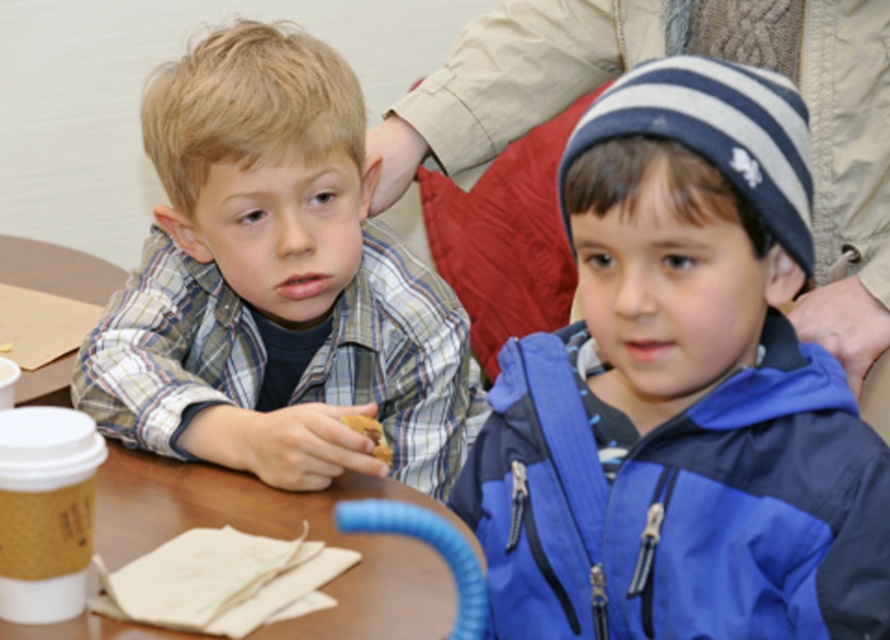
Can you confirm if blue fleece jacket at center is wider than brown crumbly cookie at center?

Yes, blue fleece jacket at center is wider than brown crumbly cookie at center.

The width and height of the screenshot is (890, 640). What do you see at coordinates (681, 392) in the screenshot?
I see `blue fleece jacket at center` at bounding box center [681, 392].

Between point (579, 566) and point (390, 461), which one is positioned in front?

Point (579, 566)

The image size is (890, 640). Find the location of `blue fleece jacket at center`. blue fleece jacket at center is located at coordinates (681, 392).

Can you confirm if plaid shirt at left is bigger than brown crumbly cookie at center?

Correct, plaid shirt at left is larger in size than brown crumbly cookie at center.

Measure the distance between point (x=220, y=346) and camera.

They are 4.21 feet apart.

Which is in front, point (206, 147) or point (370, 440)?

Positioned in front is point (370, 440).

You are a GUI agent. You are given a task and a screenshot of the screen. Output one action in this format:
    pyautogui.click(x=<x>, y=<y>)
    Task: Click on the plaid shirt at left
    The height and width of the screenshot is (640, 890).
    Given the screenshot: What is the action you would take?
    pyautogui.click(x=274, y=284)

Is point (630, 232) more distant than point (454, 433)?

No, (630, 232) is closer to viewer.

Looking at this image, is blue fleece jacket at center thinner than plaid shirt at left?

Correct, blue fleece jacket at center's width is less than plaid shirt at left's.

Is point (837, 508) less distant than point (455, 458)?

Yes, point (837, 508) is closer to viewer.

I want to click on blue fleece jacket at center, so click(x=681, y=392).